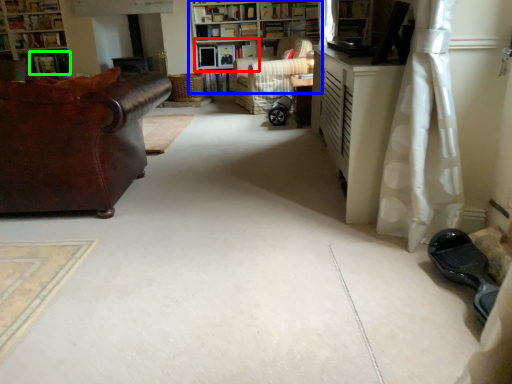
Question: Considering the real-world distances, which object is closest to shelf (highlighted by a red box)? bookcase (highlighted by a blue box) or book (highlighted by a green box).

Choices:
 (A) bookcase
 (B) book

Answer: (A)